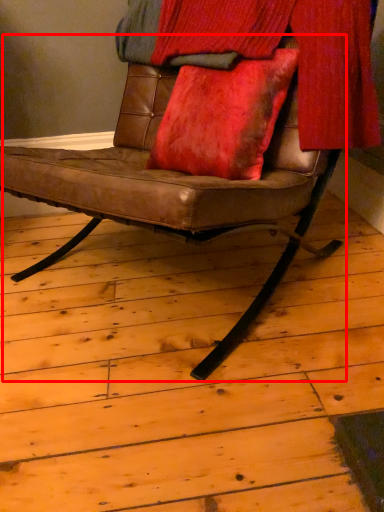
Question: From the image's perspective, where is chair (annotated by the red box) located relative to curtain?

Choices:
 (A) below
 (B) above

Answer: (A)